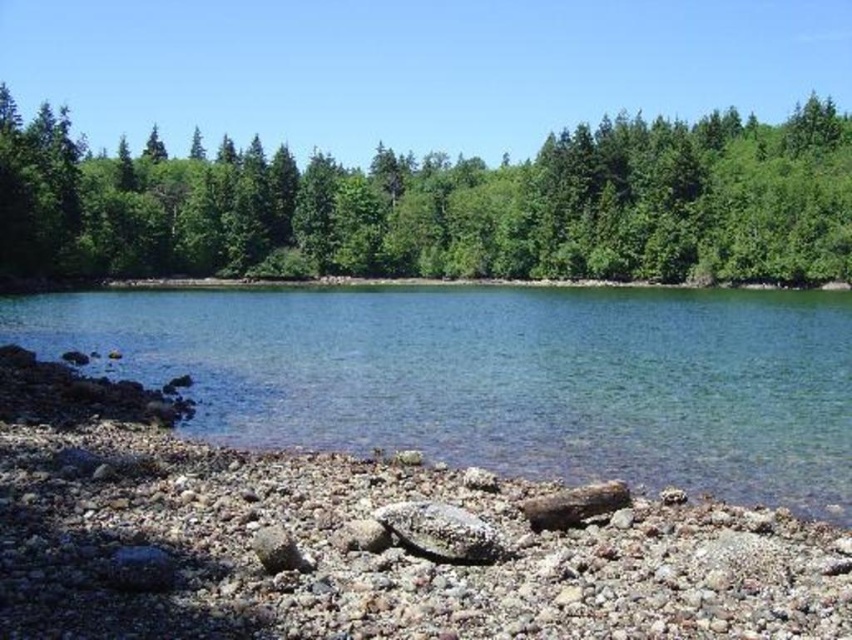
Does point (455, 308) lie in front of point (179, 236)?

That is True.

Is clear water at center closer to the viewer compared to green leafy trees at upper center?

Yes, it is in front of green leafy trees at upper center.

In order to click on clear water at center in this screenshot , I will do `click(499, 376)`.